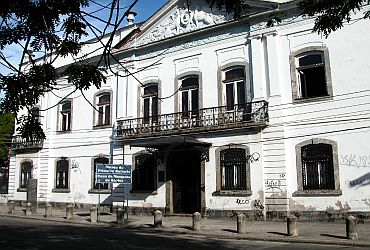
You are a GUI agent. You are given a task and a screenshot of the screen. Output one action in this format:
    pyautogui.click(x=<x>, y=<y>)
    Task: Click on the 6 windows on 1st floor
    Image resolution: width=370 pixels, height=250 pixels.
    Given the screenshot: What is the action you would take?
    [x=321, y=159], [x=248, y=173], [x=160, y=167], [x=102, y=166], [x=65, y=163], [x=18, y=171]